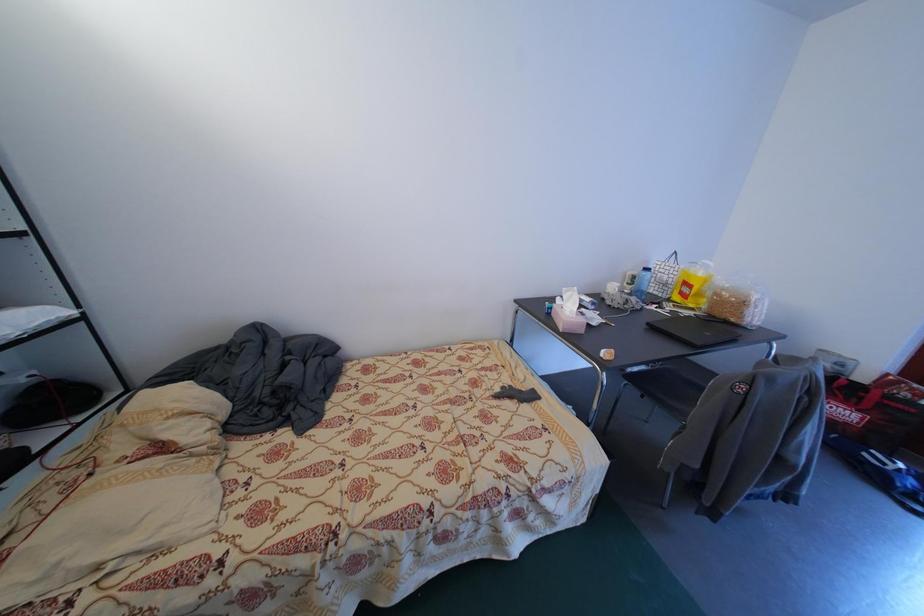
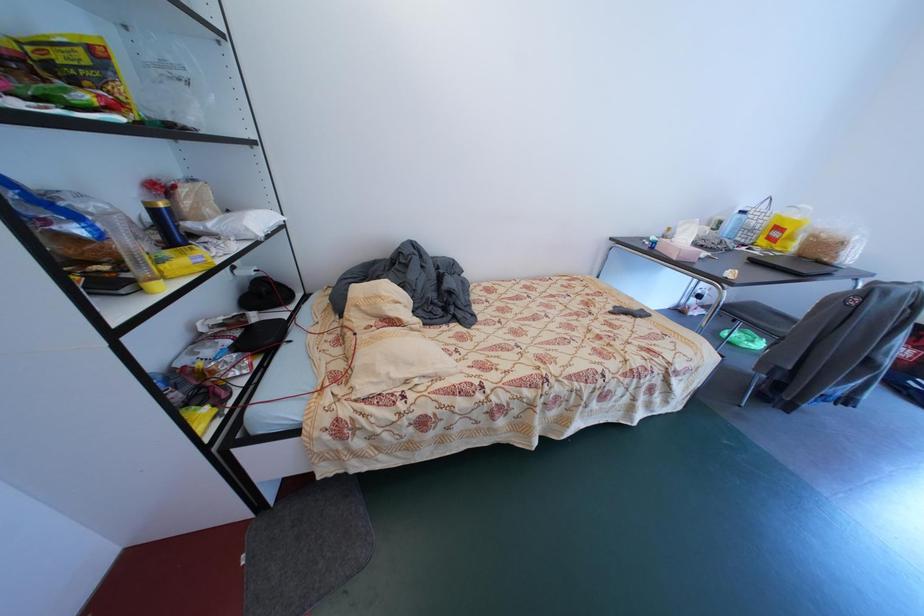
Question: The images are taken continuously from a first-person perspective. In which direction are you moving?

Choices:
 (A) Left
 (B) Right
 (C) Forward
 (D) Backward

Answer: (A)